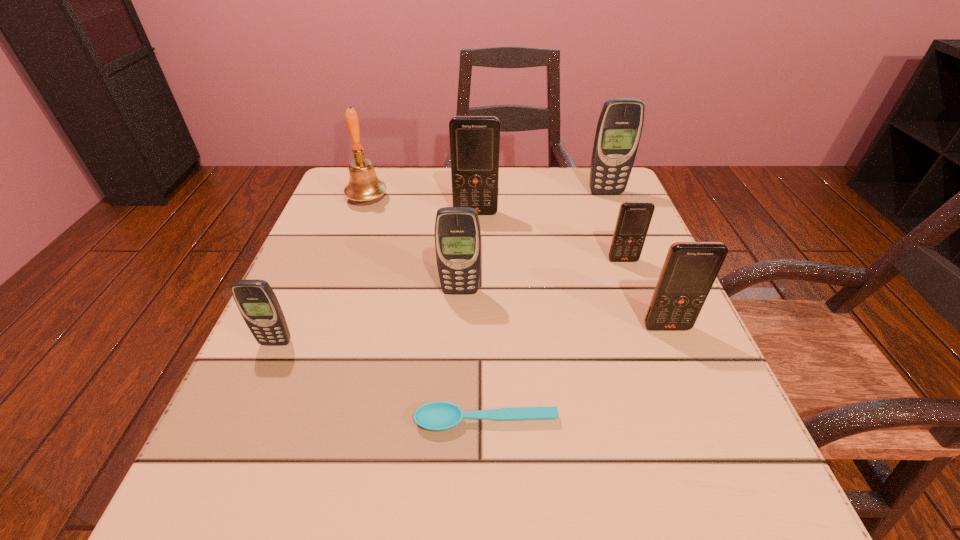
The image size is (960, 540). Find the location of `the fourth farthest object`. the fourth farthest object is located at coordinates (634, 218).

At what (x,y) coordinates should I click in order to perform the action: click on the leftmost gray cellular telephone. Please return your answer as a coordinate pair (x, y). The image size is (960, 540). Looking at the image, I should click on (255, 299).

I want to click on the smallest gray cellular telephone, so click(255, 299).

You are a GUI agent. You are given a task and a screenshot of the screen. Output one action in this format:
    pyautogui.click(x=<x>, y=<y>)
    Task: Click on the shortest object
    The image size is (960, 540).
    Given the screenshot: What is the action you would take?
    (436, 416)

Locate an element on the screen. This screenshot has height=540, width=960. spoon is located at coordinates (436, 416).

Identify the location of free space located on the screen of the biggest orange cellular telephone. The height and width of the screenshot is (540, 960). (475, 265).

This screenshot has height=540, width=960. Find the location of `vacant space located 0.170m on the screen of the rightmost gray cellular telephone`. vacant space located 0.170m on the screen of the rightmost gray cellular telephone is located at coordinates (624, 238).

Where is `blank space located 0.250m on the right of the bell`? The image size is (960, 540). blank space located 0.250m on the right of the bell is located at coordinates (493, 199).

This screenshot has height=540, width=960. Identify the location of vacant space located on the screen of the fourth nearest object. (458, 342).

Identify the location of free location located on the screen of the fifth farthest cellular telephone. This screenshot has height=540, width=960. (702, 412).